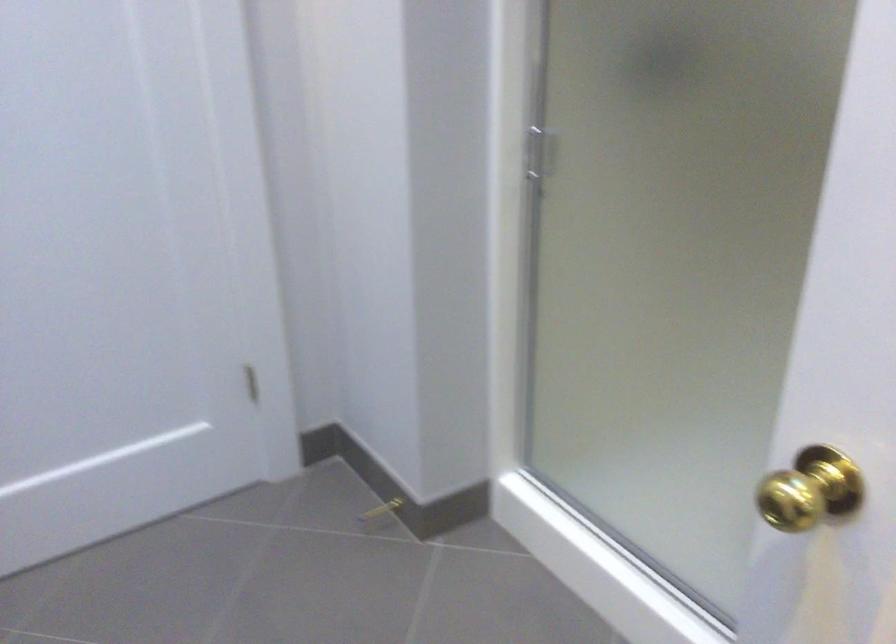
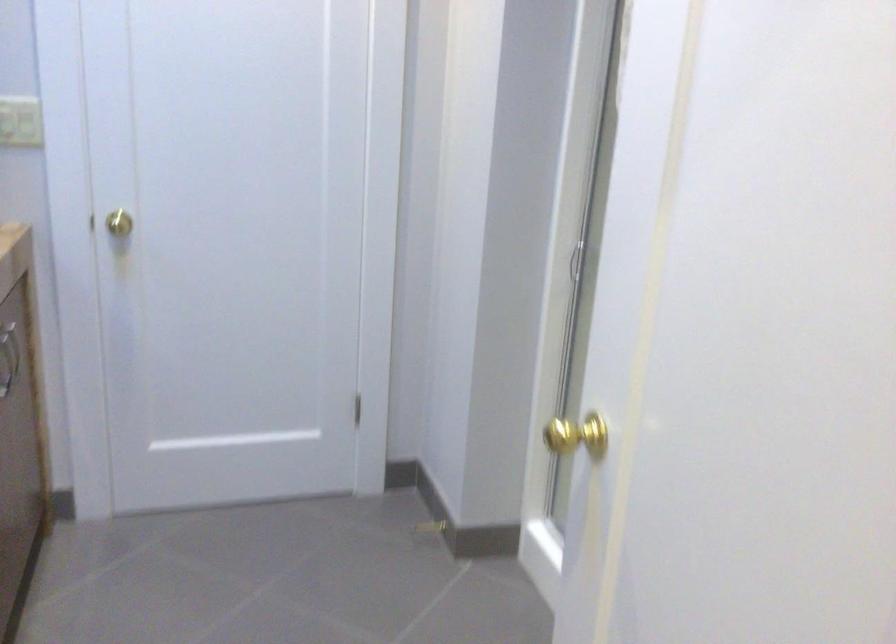
Question: The camera is either moving clockwise (left) or counter-clockwise (right) around the object. The first image is from the beginning of the video and the second image is from the end. Is the camera moving left or right when shooting the video?

Choices:
 (A) Left
 (B) Right

Answer: (B)